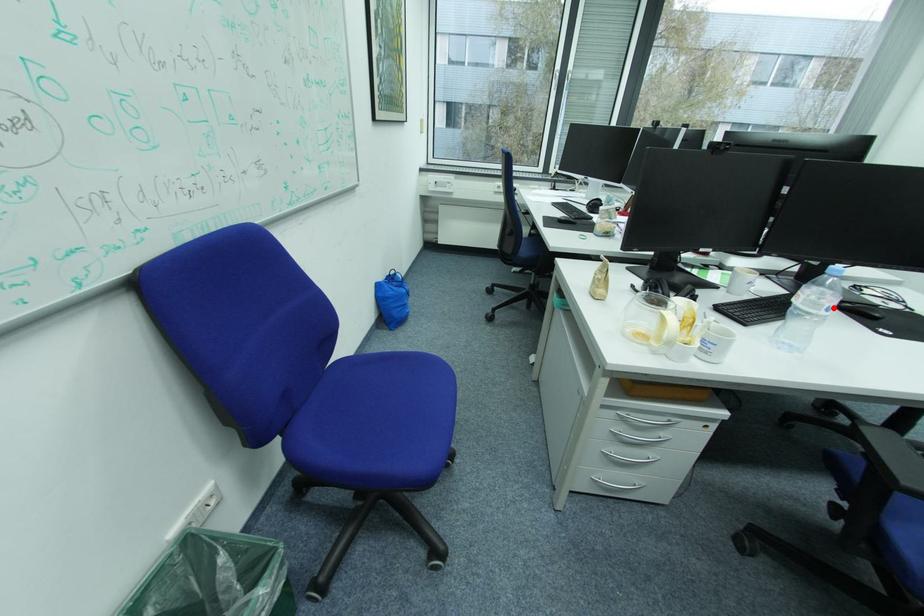
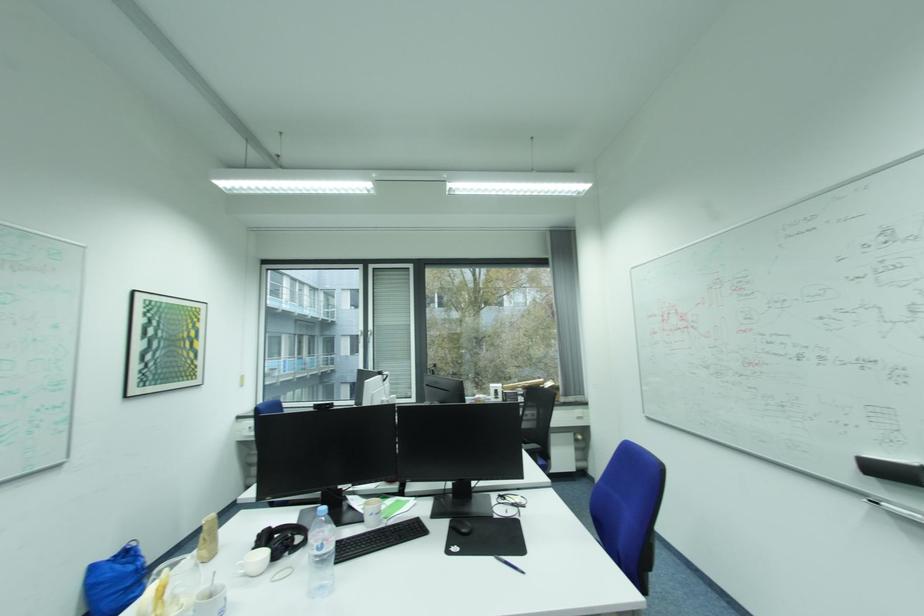
Locate, in the second image, the point that corresponds to the highlighted location in the first image.

(323, 549)